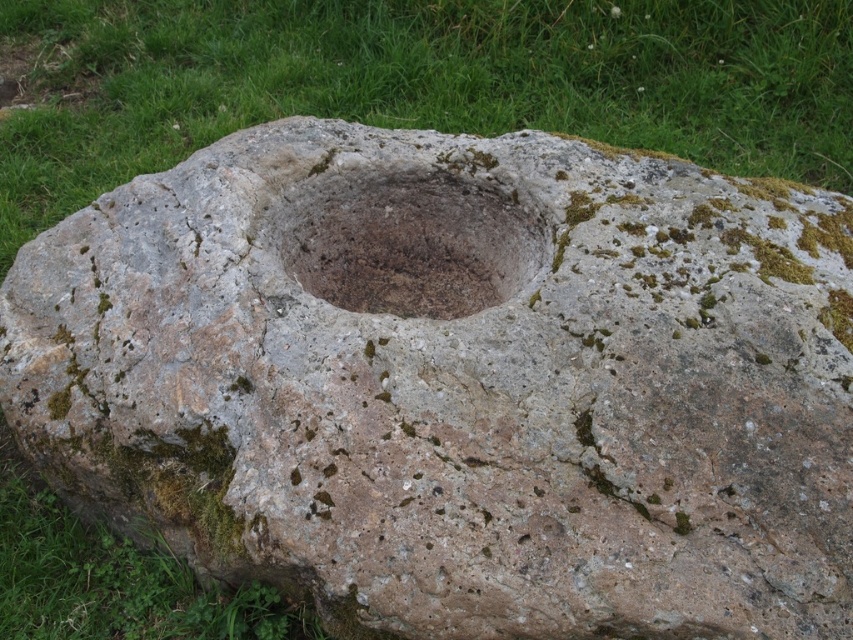
You are standing in a garden and see the green grass at upper center and the brown stone hole at center. Which object is positioned to the right side of the other?

The green grass at upper center is to the left of brown stone hole at center, so the brown stone hole at center is positioned to the right side of the green grass at upper center.

You are standing in a field and see the green grass at upper center and the brown stone hole at center. Which object is higher in position?

The green grass at upper center is higher in position than the brown stone hole at center.